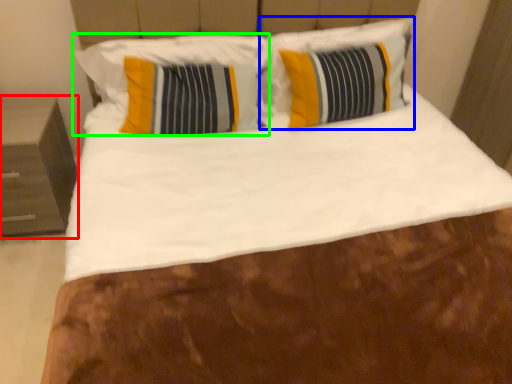
Question: Considering the real-world distances, which object is farthest from nightstand (highlighted by a red box)? pillow (highlighted by a blue box) or pillow (highlighted by a green box)?

Choices:
 (A) pillow
 (B) pillow

Answer: (A)